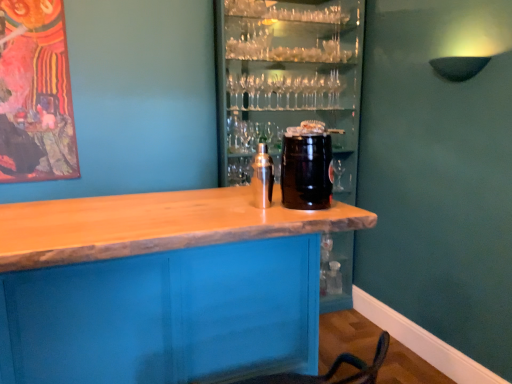
You are a GUI agent. You are given a task and a screenshot of the screen. Output one action in this format:
    pyautogui.click(x=<x>, y=<y>)
    Task: Click on the vacant space situated on the left part of satin silver shaker at center, which ranks as the 2th beverage in right-to-left order
    The width and height of the screenshot is (512, 384).
    Given the screenshot: What is the action you would take?
    pyautogui.click(x=218, y=206)